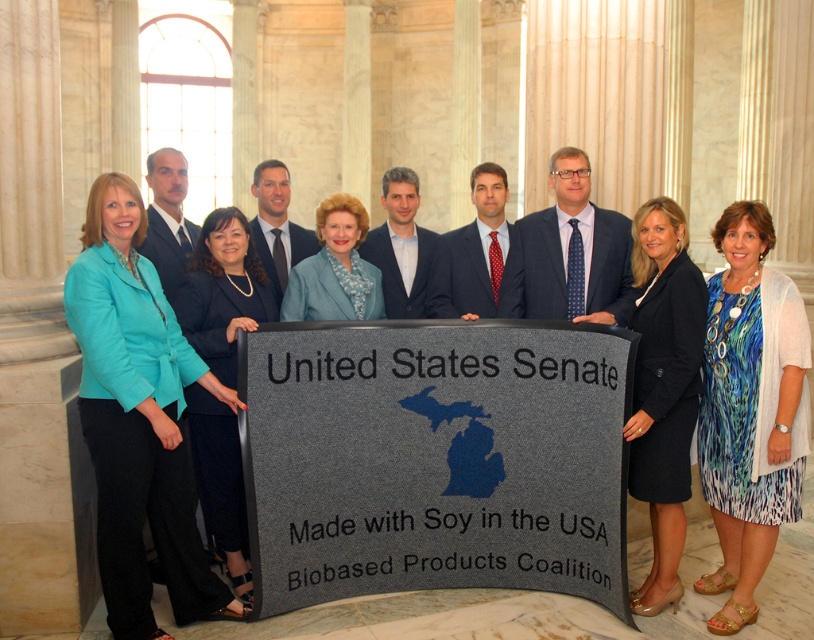
You are a photographer standing at the back of the hall. You want to take a closeup photo of the gray fabric sign at center and the teal fabric jacket at center. Can you fit both into the frame without moving your position? Explain your reasoning.

The distance between the gray fabric sign at center and the teal fabric jacket at center is 6.27 meters. Since the photographer is at the back of the hall, the field of view required to capture both objects separated by this distance might exceed the camera lens capabilities, making it difficult to fit both into the frame without moving closer or using a wider lens.

You are standing in the grand hall and want to locate the gray fabric sign at center. According to the coordinates provided, where should you look relative to the center of the image?

The gray fabric sign at center is located at coordinates point [434,458], which is slightly to the right and slightly below the center of the image.

You are attending a Senate event and notice two central figures wearing a black fabric dress at center and a blue textured suit at center. Which clothing item is lower in position compared to the other?

The black fabric dress at center is positioned under the blue textured suit at center, so the black fabric dress at center is lower in position.